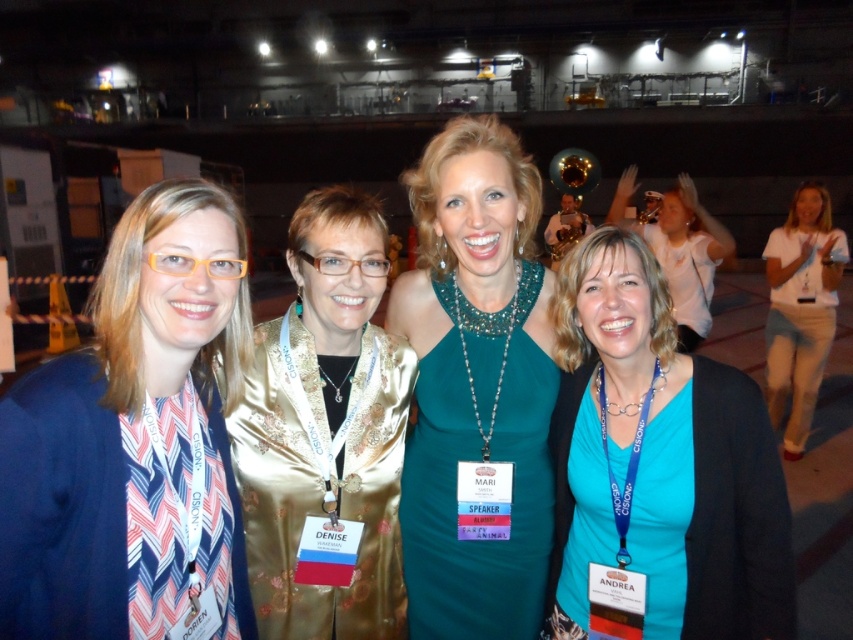
Question: Estimate the real-world distances between objects in this image. Which object is farther from the white cotton shirt at right?

Choices:
 (A) teal satin dress at lower right
 (B) teal satin dress at center
 (C) gold satin blouse at center

Answer: (C)

Question: Can you confirm if teal satin dress at center is positioned below teal satin dress at lower right?

Choices:
 (A) no
 (B) yes

Answer: (A)

Question: Which of the following is the closest to the observer?

Choices:
 (A) (695, 240)
 (B) (494, 342)
 (C) (245, 243)

Answer: (C)

Question: Does white cotton shirt at right appear on the left side of blue fabric at center?

Choices:
 (A) yes
 (B) no

Answer: (A)

Question: Can you confirm if teal satin dress at center is wider than blue fabric at center?

Choices:
 (A) no
 (B) yes

Answer: (A)

Question: Which object is closer to the camera taking this photo?

Choices:
 (A) teal satin dress at center
 (B) matte blue blazer at left
 (C) white cotton shirt at right
 (D) teal matte shirt at center

Answer: (B)